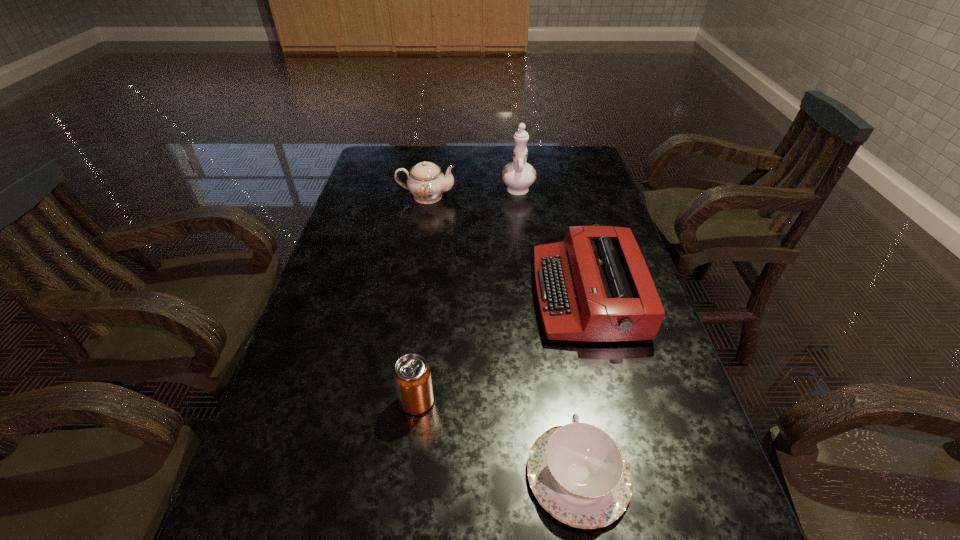
Identify the location of chinaware located in the right edge section of the desktop. The height and width of the screenshot is (540, 960). (578, 474).

What are the coordinates of `vacant region at the far edge of the desktop` in the screenshot? It's located at (513, 160).

Where is `vacant region at the left edge`? vacant region at the left edge is located at coordinates (355, 201).

Image resolution: width=960 pixels, height=540 pixels. Find the location of `vacant space at the right edge of the desktop`. vacant space at the right edge of the desktop is located at coordinates (571, 205).

This screenshot has height=540, width=960. In the image, there is a desktop. Identify the location of vacant region at the far left corner. (377, 176).

This screenshot has height=540, width=960. Identify the location of vacant area at the far right corner. (553, 165).

This screenshot has width=960, height=540. In order to click on vacant space that's between the typewriter and the tallest chinaware in this screenshot , I will do `click(552, 241)`.

The width and height of the screenshot is (960, 540). What are the coordinates of `free area in between the soda can and the second shortest object` in the screenshot? It's located at (497, 438).

Identify the location of blank region between the second nearest object and the fourth nearest object. Image resolution: width=960 pixels, height=540 pixels. (583, 386).

In order to click on empty space that is in between the third farthest object and the tallest chinaware in this screenshot , I will do `click(552, 241)`.